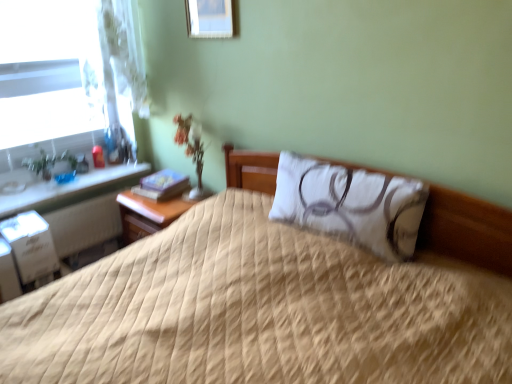
The width and height of the screenshot is (512, 384). What do you see at coordinates (50, 163) in the screenshot?
I see `green glossy plant at left` at bounding box center [50, 163].

Describe the element at coordinates (71, 189) in the screenshot. I see `white glossy window sill at left` at that location.

The width and height of the screenshot is (512, 384). I want to click on white quilted pillow at center, so click(x=351, y=204).

Measure the distance between point (339, 207) and camera.

A distance of 5.59 feet exists between point (339, 207) and camera.

This screenshot has width=512, height=384. What are the coordinates of `beige quilted bed at center` in the screenshot? It's located at (274, 302).

Locate an element on the screen. The width and height of the screenshot is (512, 384). green glossy plant at left is located at coordinates (50, 163).

Does green glossy plant at left have a greater width compared to wooden picture frame at upper center?

Correct, the width of green glossy plant at left exceeds that of wooden picture frame at upper center.

From a real-world perspective, who is located lower, green glossy plant at left or wooden picture frame at upper center?

green glossy plant at left is physically lower.

Is the surface of green glossy plant at left in direct contact with wooden picture frame at upper center?

green glossy plant at left and wooden picture frame at upper center are not in contact.

Considering the relative sizes of green glossy plant at left and wooden picture frame at upper center in the image provided, is green glossy plant at left taller than wooden picture frame at upper center?

Indeed, green glossy plant at left has a greater height compared to wooden picture frame at upper center.

Does clear glass window at left appear on the right side of white quilted pillow at center?

Incorrect, clear glass window at left is not on the right side of white quilted pillow at center.

From a real-world perspective, is clear glass window at left physically located above or below white quilted pillow at center?

clear glass window at left is above white quilted pillow at center.

Is clear glass window at left taller or shorter than white quilted pillow at center?

clear glass window at left is taller than white quilted pillow at center.

Who is shorter, white cardboard file cabinet at lower left or green glossy plant at left?

With less height is green glossy plant at left.

Locate an element on the screen. The height and width of the screenshot is (384, 512). file cabinet below the green glossy plant at left (from the image's perspective) is located at coordinates [x=31, y=248].

From the image's perspective, is white cardboard file cabinet at lower left positioned above or below green glossy plant at left?

white cardboard file cabinet at lower left is situated lower than green glossy plant at left in the image.

Is point (50, 266) closer or farther from the camera than point (70, 179)?

Point (50, 266) appears to be closer to the viewer than point (70, 179).

Does wooden picture frame at upper center touch white glossy window sill at left?

No, wooden picture frame at upper center is not next to white glossy window sill at left.

From the picture: Is wooden picture frame at upper center in front of or behind white glossy window sill at left in the image?

wooden picture frame at upper center is positioned closer to the viewer than white glossy window sill at left.

Between wooden picture frame at upper center and white glossy window sill at left, which one has less height?

Standing shorter between the two is white glossy window sill at left.

Does wooden picture frame at upper center turn towards white glossy window sill at left?

No, wooden picture frame at upper center is not turned towards white glossy window sill at left.

From the picture: Considering the sizes of objects clear glass window at left and wooden picture frame at upper center in the image provided, who is bigger, clear glass window at left or wooden picture frame at upper center?

Bigger between the two is clear glass window at left.

Could you tell me if clear glass window at left is turned towards wooden picture frame at upper center?

Yes, clear glass window at left is turned towards wooden picture frame at upper center.

Are clear glass window at left and wooden picture frame at upper center located far from each other?

That's not correct — clear glass window at left is a little close to wooden picture frame at upper center.

This screenshot has width=512, height=384. I want to click on window that appears behind the wooden picture frame at upper center, so click(47, 31).

Is green glossy plant at left positioned behind white cardboard file cabinet at lower left?

That is True.

Considering the sizes of objects green glossy plant at left and white cardboard file cabinet at lower left in the image provided, who is wider, green glossy plant at left or white cardboard file cabinet at lower left?

With larger width is white cardboard file cabinet at lower left.

Is green glossy plant at left not inside white cardboard file cabinet at lower left?

Yes.

Is point (46, 163) closer or farther from the camera than point (36, 238)?

Clearly, point (46, 163) is more distant from the camera than point (36, 238).

Does green glossy plant at left have a lesser height compared to white glossy window sill at left?

In fact, green glossy plant at left may be taller than white glossy window sill at left.

From a real-world perspective, is green glossy plant at left physically below white glossy window sill at left?

Incorrect, from a real-world perspective, green glossy plant at left is higher than white glossy window sill at left.

From the image's perspective, does green glossy plant at left appear lower than white glossy window sill at left?

Actually, green glossy plant at left appears above white glossy window sill at left in the image.

Locate an element on the screen. This screenshot has height=384, width=512. picture frame above the green glossy plant at left (from the image's perspective) is located at coordinates (209, 18).

The width and height of the screenshot is (512, 384). In order to click on pillow below the clear glass window at left (from the image's perspective) in this screenshot , I will do `click(351, 204)`.

From the image, which object appears to be farther from beige quilted bed at center, clear glass window at left or white quilted pillow at center?

clear glass window at left lies further to beige quilted bed at center than the other object.

Based on their spatial positions, is green glossy plant at left or white quilted pillow at center closer to white glossy window sill at left?

green glossy plant at left lies closer to white glossy window sill at left than the other object.

Which object lies nearer to the anchor point beige quilted bed at center, white cardboard file cabinet at lower left or white quilted pillow at center?

white quilted pillow at center lies closer to beige quilted bed at center than the other object.

When comparing their distances from white cardboard file cabinet at lower left, does white quilted pillow at center or green glossy plant at left seem closer?

Among the two, green glossy plant at left is located nearer to white cardboard file cabinet at lower left.

Based on their spatial positions, is green glossy plant at left or white glossy window sill at left closer to white quilted pillow at center?

Among the two, white glossy window sill at left is located nearer to white quilted pillow at center.

When comparing their distances from clear glass window at left, does white glossy window sill at left or white quilted pillow at center seem closer?

Based on the image, white glossy window sill at left appears to be nearer to clear glass window at left.

Looking at the image, which one is located closer to white quilted pillow at center, white glossy window sill at left or green glossy plant at left?

Among the two, white glossy window sill at left is located nearer to white quilted pillow at center.

Looking at the image, which one is located further to white cardboard file cabinet at lower left, white quilted pillow at center or white glossy window sill at left?

white quilted pillow at center lies further to white cardboard file cabinet at lower left than the other object.

Where is `pillow between beige quilted bed at center and white glossy window sill at left from front to back`? Image resolution: width=512 pixels, height=384 pixels. pillow between beige quilted bed at center and white glossy window sill at left from front to back is located at coordinates (351, 204).

Identify the location of window sill between green glossy plant at left and wooden picture frame at upper center from left to right. (71, 189).

The width and height of the screenshot is (512, 384). I want to click on window sill between clear glass window at left and wooden picture frame at upper center in the horizontal direction, so click(71, 189).

The height and width of the screenshot is (384, 512). What are the coordinates of `pillow located between beige quilted bed at center and white cardboard file cabinet at lower left in the depth direction` in the screenshot? It's located at (351, 204).